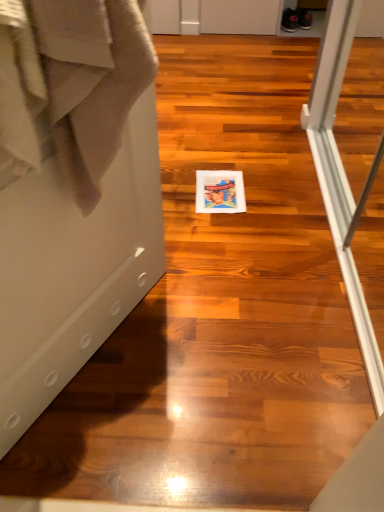
Question: Is the position of white glossy screen door at center more distant than that of matte paper postcard at center?

Choices:
 (A) yes
 (B) no

Answer: (B)

Question: Is matte paper postcard at center surrounded by white glossy screen door at center?

Choices:
 (A) no
 (B) yes

Answer: (A)

Question: Considering the relative positions of white glossy screen door at center and matte paper postcard at center in the image provided, is white glossy screen door at center to the left of matte paper postcard at center from the viewer's perspective?

Choices:
 (A) no
 (B) yes

Answer: (B)

Question: From a real-world perspective, is white glossy screen door at center physically above matte paper postcard at center?

Choices:
 (A) yes
 (B) no

Answer: (A)

Question: Is white glossy screen door at center at the right side of matte paper postcard at center?

Choices:
 (A) no
 (B) yes

Answer: (A)

Question: Do you think beige cotton bath towel at left is within white glossy screen door at center, or outside of it?

Choices:
 (A) inside
 (B) outside

Answer: (B)

Question: From a real-world perspective, is beige cotton bath towel at left positioned above or below white glossy screen door at center?

Choices:
 (A) below
 (B) above

Answer: (B)

Question: Considering the relative positions of beige cotton bath towel at left and white glossy screen door at center in the image provided, is beige cotton bath towel at left to the left or to the right of white glossy screen door at center?

Choices:
 (A) right
 (B) left

Answer: (A)

Question: In terms of size, does beige cotton bath towel at left appear bigger or smaller than white glossy screen door at center?

Choices:
 (A) small
 (B) big

Answer: (A)

Question: Choose the correct answer: Is matte paper postcard at center inside white glossy screen door at center or outside it?

Choices:
 (A) inside
 (B) outside

Answer: (B)

Question: In terms of size, does matte paper postcard at center appear bigger or smaller than white glossy screen door at center?

Choices:
 (A) big
 (B) small

Answer: (B)

Question: Considering the positions of matte paper postcard at center and white glossy screen door at center in the image, is matte paper postcard at center wider or thinner than white glossy screen door at center?

Choices:
 (A) wide
 (B) thin

Answer: (A)

Question: From a real-world perspective, relative to white glossy screen door at center, is matte paper postcard at center vertically above or below?

Choices:
 (A) above
 (B) below

Answer: (B)

Question: Is beige cotton bath towel at left inside or outside of matte paper postcard at center?

Choices:
 (A) outside
 (B) inside

Answer: (A)

Question: Relative to matte paper postcard at center, is beige cotton bath towel at left in front or behind?

Choices:
 (A) behind
 (B) front

Answer: (B)